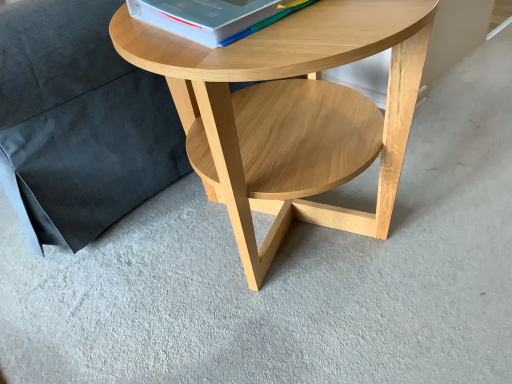
Find the location of `free point below natural wood coffee table at center (from a real-world perspective)`. free point below natural wood coffee table at center (from a real-world perspective) is located at coordinates (301, 244).